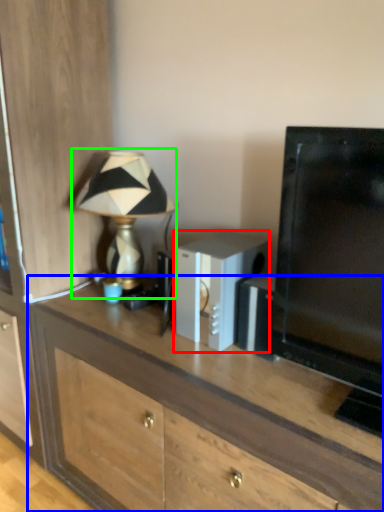
Question: Considering the real-world distances, which object is closest to appliance (highlighted by a red box)? desk (highlighted by a blue box) or lamp (highlighted by a green box).

Choices:
 (A) desk
 (B) lamp

Answer: (A)